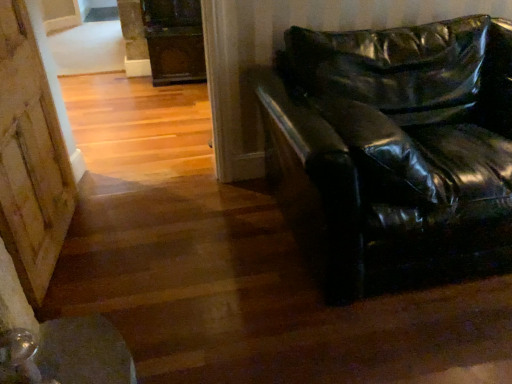
Question: From their relative heights in the image, would you say glossy black leather couch at right is taller or shorter than wooden barn door at lower left?

Choices:
 (A) short
 (B) tall

Answer: (A)

Question: Considering their positions, is glossy black leather couch at right located in front of or behind wooden barn door at lower left?

Choices:
 (A) front
 (B) behind

Answer: (A)

Question: Based on their sizes in the image, would you say glossy black leather couch at right is bigger or smaller than wooden barn door at lower left?

Choices:
 (A) small
 (B) big

Answer: (B)

Question: In the image, is wooden barn door at lower left positioned in front of or behind glossy black leather couch at right?

Choices:
 (A) behind
 (B) front

Answer: (A)

Question: Looking at their shapes, would you say wooden barn door at lower left is wider or thinner than glossy black leather couch at right?

Choices:
 (A) wide
 (B) thin

Answer: (B)

Question: Is wooden barn door at lower left taller or shorter than glossy black leather couch at right?

Choices:
 (A) tall
 (B) short

Answer: (A)

Question: From the image's perspective, is wooden barn door at lower left located above or below glossy black leather couch at right?

Choices:
 (A) below
 (B) above

Answer: (A)